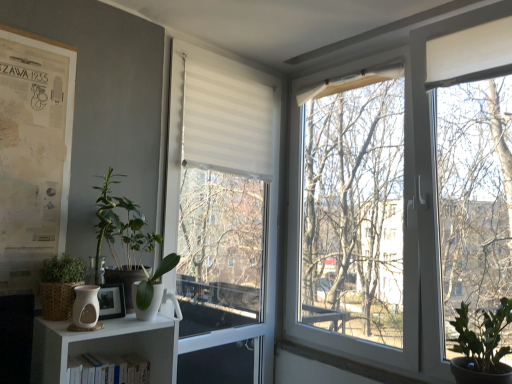
Question: From the image's perspective, is white matte bookshelf at lower left positioned above or below white matte window at center?

Choices:
 (A) below
 (B) above

Answer: (A)

Question: Is white matte bookshelf at lower left inside the boundaries of white matte window at center, or outside?

Choices:
 (A) inside
 (B) outside

Answer: (B)

Question: Which of these objects is positioned farthest from the matte white vase at lower left?

Choices:
 (A) green leafy plant at left, which is the third vegetation in right-to-left order
 (B) green matte plant at left, which is counted as the second vegetation, starting from the right
 (C) white glossy pot at lower left
 (D) green matte plant at lower right, the third vegetation positioned from the left
 (E) wooden picture frame at lower left

Answer: (D)

Question: Which object is positioned farthest from the wooden picture frame at lower left?

Choices:
 (A) matte white vase at lower left
 (B) white matte bookshelf at lower left
 (C) white matte window at center
 (D) white glossy pot at lower left
 (E) green matte plant at left, which is counted as the second vegetation, starting from the right

Answer: (C)